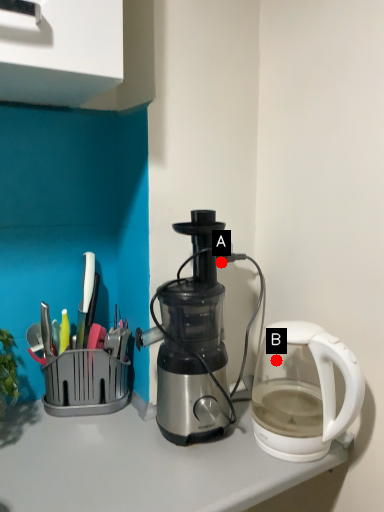
Question: Two points are circled on the image, labeled by A and B beside each circle. Which point is further to the camera?

Choices:
 (A) A is further
 (B) B is further

Answer: (A)